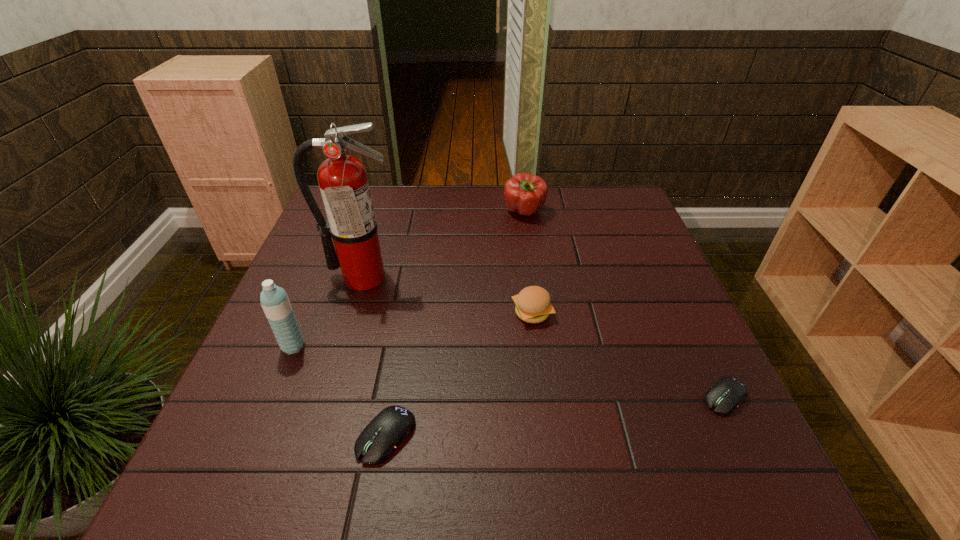
You are a GUI agent. You are given a task and a screenshot of the screen. Output one action in this format:
    pyautogui.click(x=<x>, y=<y>)
    Task: Click on the second farthest object
    Image resolution: width=960 pixels, height=540 pixels.
    Given the screenshot: What is the action you would take?
    pyautogui.click(x=343, y=182)

Identify the location of the tallest object. The width and height of the screenshot is (960, 540). (343, 182).

Where is `free space located 0.220m on the right of the taller computer equipment`? free space located 0.220m on the right of the taller computer equipment is located at coordinates (534, 436).

Locate an element on the screen. This screenshot has height=540, width=960. free region located on the left of the rightmost object is located at coordinates (636, 397).

Where is `free space located on the front of the bell pepper`? free space located on the front of the bell pepper is located at coordinates (529, 242).

Find the location of a particular element. vacant area situated on the right of the water bottle is located at coordinates (474, 346).

I want to click on vacant area located on the left of the third farthest object, so click(x=444, y=313).

The image size is (960, 540). What are the coordinates of `vacant space located on the nozzle side of the tallest object` in the screenshot? It's located at (315, 435).

The image size is (960, 540). In order to click on object that is at the far edge in this screenshot , I will do `click(524, 193)`.

Locate an element on the screen. The width and height of the screenshot is (960, 540). water bottle situated at the left edge is located at coordinates (274, 300).